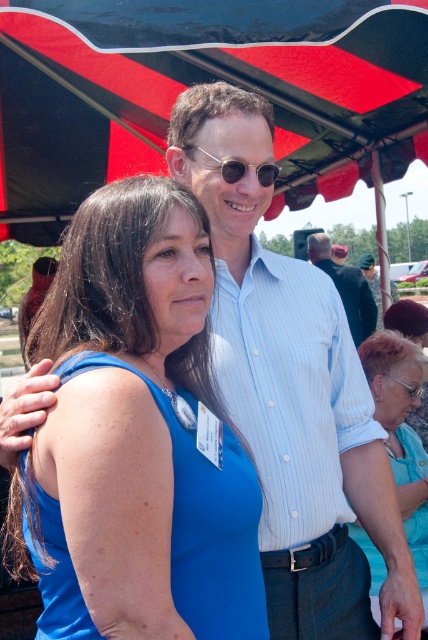
Question: Is dark blue shirt at center above sunglasses at center?

Choices:
 (A) yes
 (B) no

Answer: (B)

Question: Is blue matte dress at lower left smaller than dark blue shirt at center?

Choices:
 (A) yes
 (B) no

Answer: (A)

Question: Which point appears closest to the camera in this image?

Choices:
 (A) (196, 24)
 (B) (276, 168)
 (C) (419, 380)

Answer: (B)

Question: Estimate the real-world distances between objects in this image. Which object is farther from the dark blue uniform at center?

Choices:
 (A) black fabric canopy at upper center
 (B) dark blue shirt at center

Answer: (A)

Question: Which of the following is the farthest from the observer?

Choices:
 (A) black fabric canopy at upper center
 (B) blue matte dress at lower left

Answer: (A)

Question: Can you confirm if black fabric canopy at upper center is positioned below blue matte dress at lower left?

Choices:
 (A) yes
 (B) no

Answer: (B)